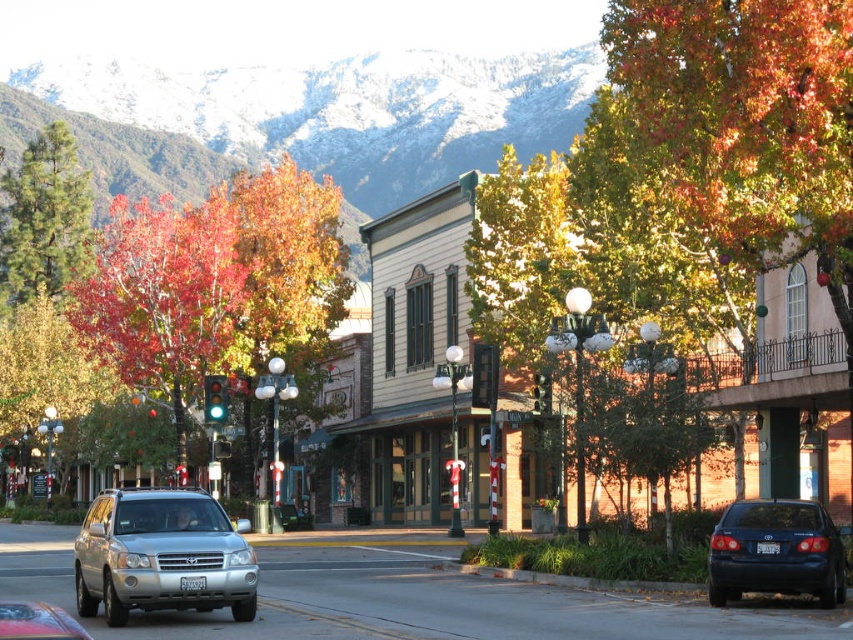
Is snowy mountain at upper center above glossy dark blue sedan at lower right?

Yes.

Between snowy mountain at upper center and glossy dark blue sedan at lower right, which one has less height?

Standing shorter between the two is glossy dark blue sedan at lower right.

Does point (102, 70) come farther from viewer compared to point (811, 586)?

Yes, it is.

Identify the location of snowy mountain at upper center. The image size is (853, 640). (344, 109).

Is point (64, 104) farther from camera compared to point (73, 278)?

That is True.

You are a GUI agent. You are given a task and a screenshot of the screen. Output one action in this format:
    pyautogui.click(x=<x>, y=<y>)
    Task: Click on the snowy mountain at upper center
    
    Given the screenshot: What is the action you would take?
    pyautogui.click(x=344, y=109)

Image resolution: width=853 pixels, height=640 pixels. I want to click on snowy mountain at upper center, so click(x=344, y=109).

Is point (235, 141) closer to viewer compared to point (235, 305)?

No, it is not.

Find the location of a particular element. The width and height of the screenshot is (853, 640). snowy mountain at upper center is located at coordinates (344, 109).